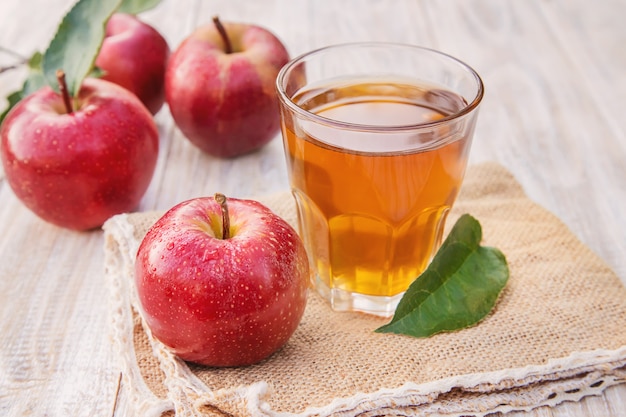
I want to click on glass, so click(376, 142).